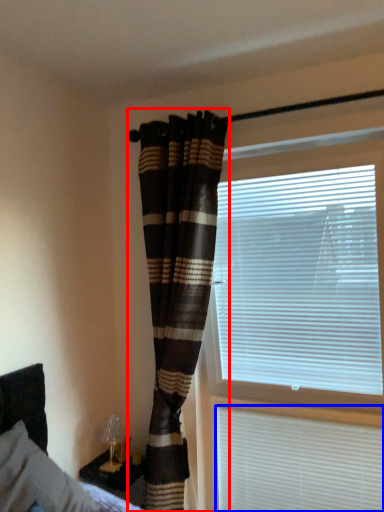
Question: Which of the following is the farthest to the observer, curtain (highlighted by a red box) or window blind (highlighted by a blue box)?

Choices:
 (A) curtain
 (B) window blind

Answer: (B)